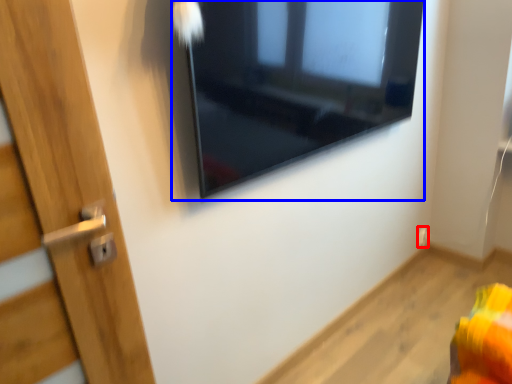
Question: Which object is further to the camera taking this photo, electric outlet (highlighted by a red box) or window (highlighted by a blue box)?

Choices:
 (A) electric outlet
 (B) window

Answer: (A)